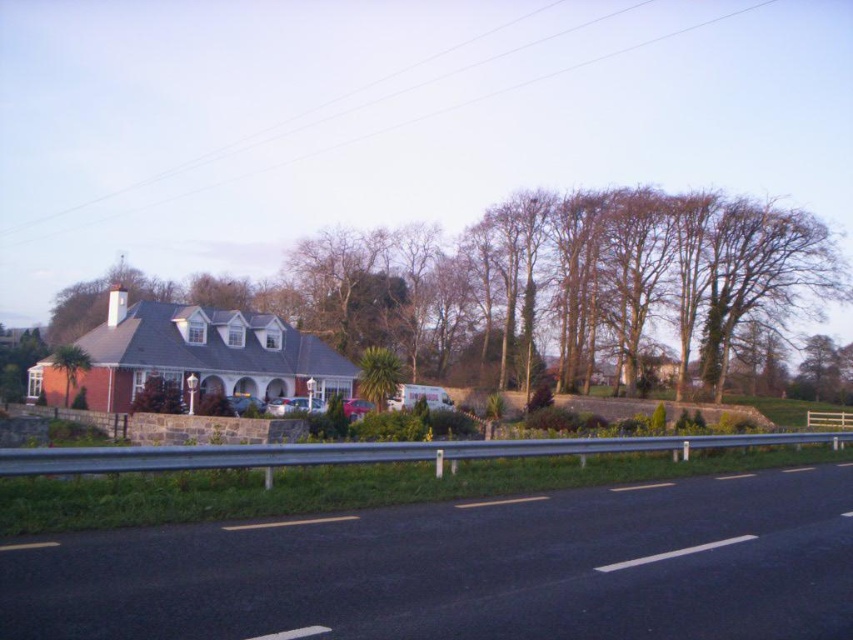
You are standing at the point marked by the coordinates point (x=468, y=570) in the image. What is the object located at that point?

The point (x=468, y=570) marks the black asphalt road at lower center.

Based on the photo, you are a pedestrian standing on the sidewalk next to the black asphalt road at lower center and the brown textured tree at center. Which object is closer to your right side?

The black asphalt road at lower center is closer to your right side because it is positioned to the right of the brown textured tree at center.

You are a pedestrian walking along the road and want to see both the brown textured tree at center and the green leafy tree at left. Which tree will appear closer to you when you look towards the house?

The brown textured tree at center will appear closer because the green leafy tree at left is positioned behind it, making the brown textured tree at center the one in the foreground.